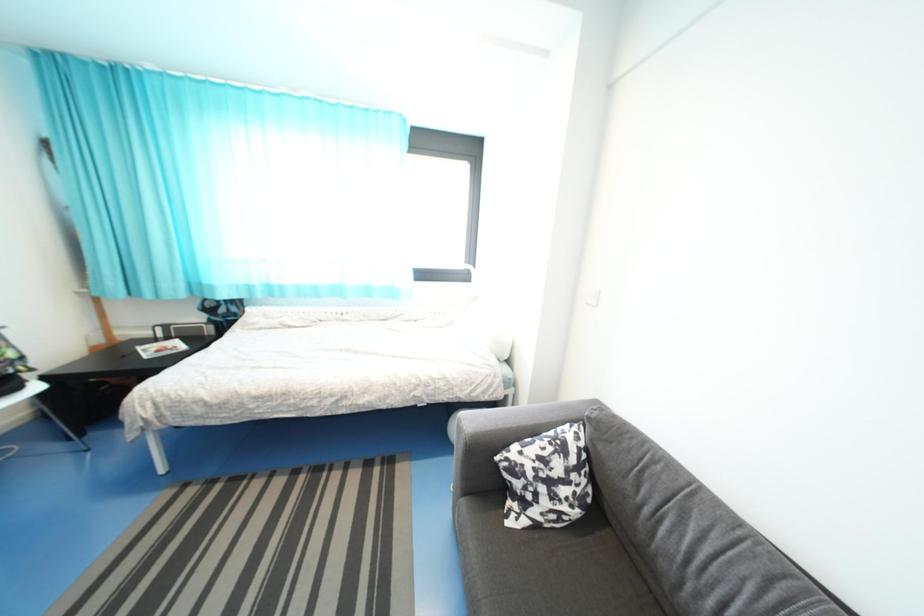
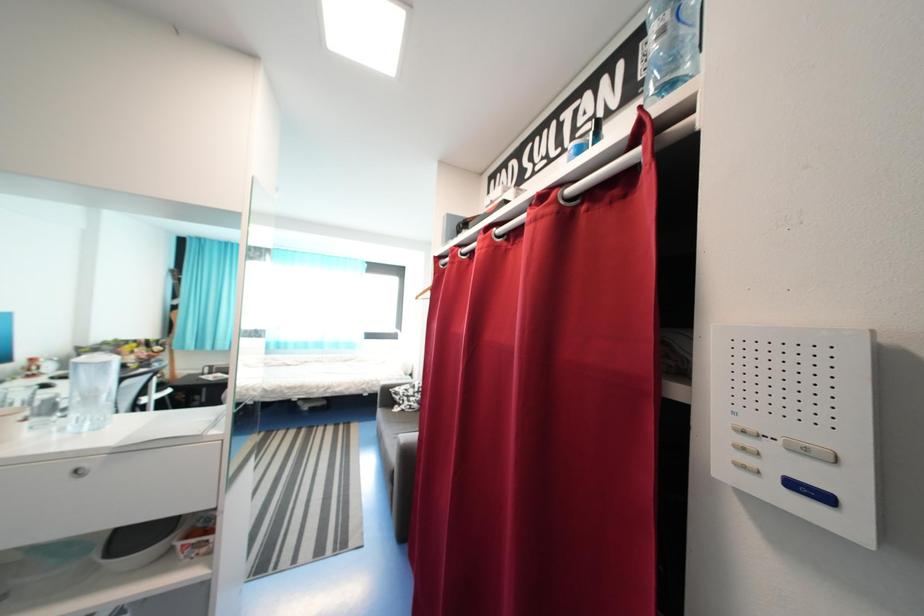
Question: The images are taken continuously from a first-person perspective. In which direction are you moving?

Choices:
 (A) Left
 (B) Right
 (C) Forward
 (D) Backward

Answer: (D)